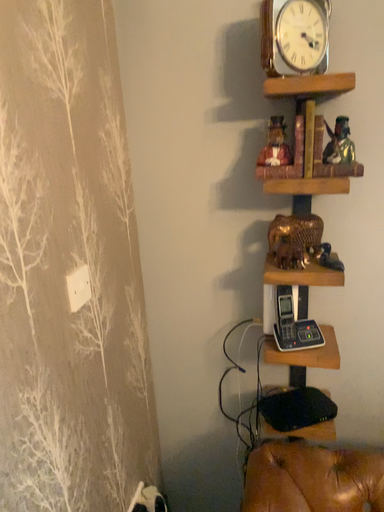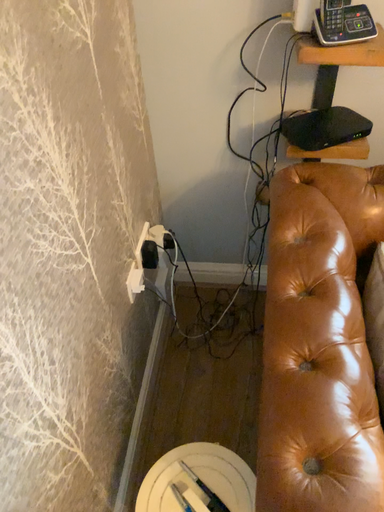
Question: How did the camera likely rotate when shooting the video?

Choices:
 (A) rotated upward
 (B) rotated downward

Answer: (B)